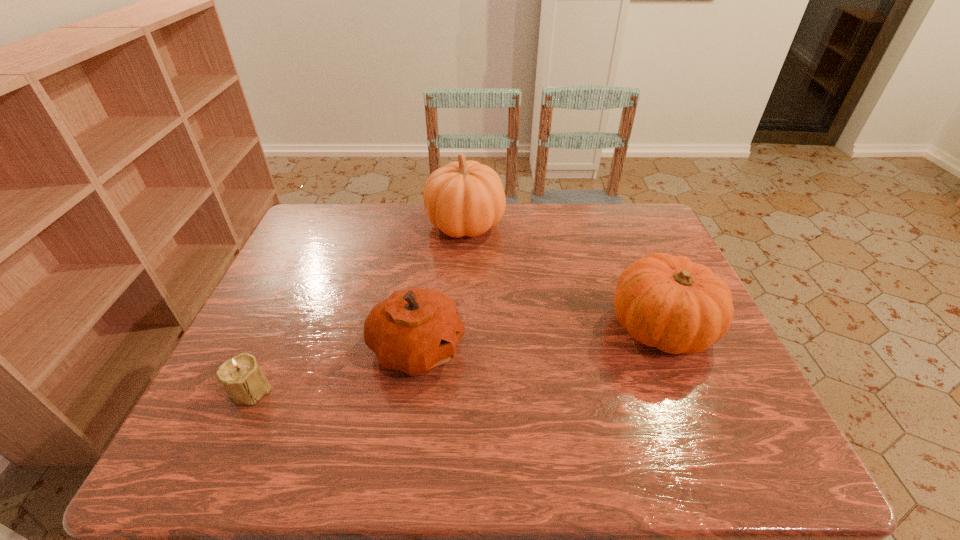
Locate an element on the screen. the tallest object is located at coordinates (464, 198).

You are a GUI agent. You are given a task and a screenshot of the screen. Output one action in this format:
    pyautogui.click(x=<x>, y=<y>)
    Task: Click on the tallest pumpkin
    
    Given the screenshot: What is the action you would take?
    pyautogui.click(x=464, y=198)

You are a GUI agent. You are given a task and a screenshot of the screen. Output one action in this format:
    pyautogui.click(x=<x>, y=<y>)
    Task: Click on the rightmost pumpkin
    The image size is (960, 540).
    Given the screenshot: What is the action you would take?
    pyautogui.click(x=663, y=301)

Identify the location of the shortest object. point(243,379).

The image size is (960, 540). I want to click on candle_holder, so click(243, 379).

I want to click on vacant space located on the left of the farthest pumpkin, so click(x=331, y=225).

At what (x,y) coordinates should I click in order to perform the action: click on vacant space situated 0.390m on the left of the rightmost object. Please return your answer as a coordinate pair (x, y). Looking at the image, I should click on (447, 327).

Locate an element on the screen. The width and height of the screenshot is (960, 540). vacant space situated on the back of the leftmost object is located at coordinates (286, 313).

Image resolution: width=960 pixels, height=540 pixels. Identify the location of object located in the far edge section of the desktop. (464, 198).

Locate an element on the screen. object that is at the left edge is located at coordinates (243, 379).